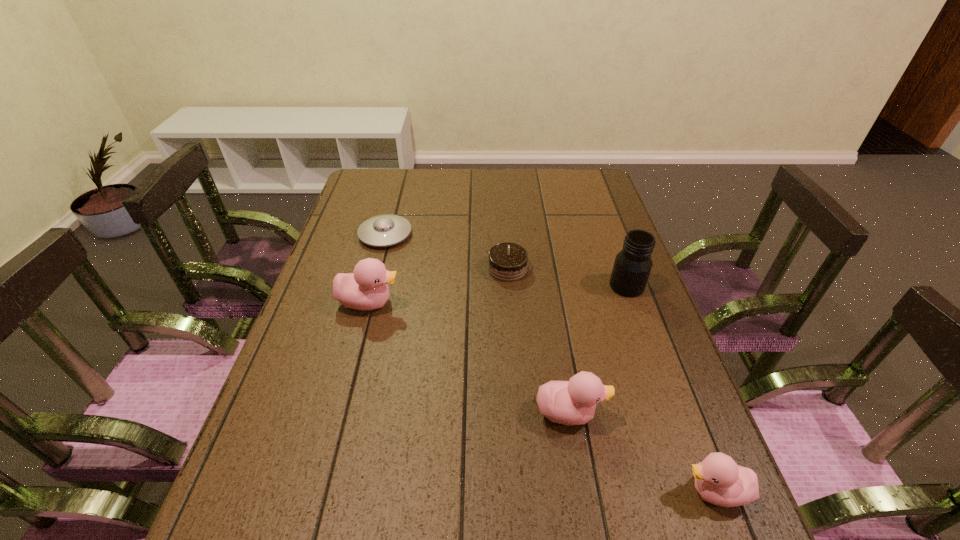
I want to click on the leftmost duckling, so click(x=365, y=289).

Locate an element on the screen. This screenshot has width=960, height=540. the second tallest duckling is located at coordinates (573, 402).

Find the location of a particular element. This screenshot has width=960, height=540. the second duckling from right to left is located at coordinates (573, 402).

Where is `the nearest duckling`? Image resolution: width=960 pixels, height=540 pixels. the nearest duckling is located at coordinates (719, 480).

The height and width of the screenshot is (540, 960). I want to click on the third shortest object, so coord(719,480).

Where is `chocolate cake`? Image resolution: width=960 pixels, height=540 pixels. chocolate cake is located at coordinates (508, 262).

The image size is (960, 540). In order to click on the farthest object in this screenshot , I will do `click(385, 230)`.

The width and height of the screenshot is (960, 540). In order to click on saucer in this screenshot , I will do `click(385, 230)`.

The height and width of the screenshot is (540, 960). I want to click on jar, so click(632, 266).

Where is `vacant space located 0.330m on the front-facing side of the leftmost duckling`? vacant space located 0.330m on the front-facing side of the leftmost duckling is located at coordinates (524, 302).